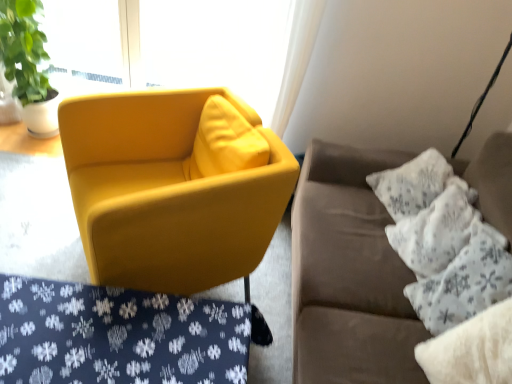
Question: Would you say white fluffy pillow at right, the first pillow when ordered from front to back, is a long distance from white textured pillow at right, which ranks as the first pillow in back-to-front order?

Choices:
 (A) no
 (B) yes

Answer: (A)

Question: Is white fluffy pillow at right, the first pillow when ordered from front to back, surrounding white textured pillow at right, positioned as the third pillow in front-to-back order?

Choices:
 (A) no
 (B) yes

Answer: (A)

Question: Is white fluffy pillow at right, the first pillow when ordered from front to back, aimed at white textured pillow at right, which ranks as the first pillow in back-to-front order?

Choices:
 (A) yes
 (B) no

Answer: (B)

Question: Would you say white fluffy pillow at right, the first pillow when ordered from front to back, is outside white textured pillow at right, which ranks as the first pillow in back-to-front order?

Choices:
 (A) no
 (B) yes

Answer: (B)

Question: From a real-world perspective, is white fluffy pillow at right, which appears as the third pillow when viewed from the back, positioned over white textured pillow at right, positioned as the third pillow in front-to-back order, based on gravity?

Choices:
 (A) no
 (B) yes

Answer: (B)

Question: Is matte glass window at upper left in front of or behind white textured pillow at right, positioned as the third pillow in front-to-back order, in the image?

Choices:
 (A) behind
 (B) front

Answer: (A)

Question: Considering the relative positions of matte glass window at upper left and white textured pillow at right, positioned as the third pillow in front-to-back order, in the image provided, is matte glass window at upper left to the left or to the right of white textured pillow at right, positioned as the third pillow in front-to-back order,?

Choices:
 (A) left
 (B) right

Answer: (A)

Question: Considering the positions of point (226, 66) and point (445, 225), is point (226, 66) closer or farther from the camera than point (445, 225)?

Choices:
 (A) farther
 (B) closer

Answer: (A)

Question: Is matte glass window at upper left spatially inside white textured pillow at right, positioned as the third pillow in front-to-back order, or outside of it?

Choices:
 (A) outside
 (B) inside

Answer: (A)

Question: From the image's perspective, is white textured pillow at right, placed as the 2th pillow when sorted from back to front, located above or below matte yellow armchair at center?

Choices:
 (A) above
 (B) below

Answer: (B)

Question: Is point (485, 271) positioned closer to the camera than point (144, 258)?

Choices:
 (A) closer
 (B) farther

Answer: (A)

Question: Do you think white textured pillow at right, placed as the 2th pillow when sorted from back to front, is within matte yellow armchair at center, or outside of it?

Choices:
 (A) outside
 (B) inside

Answer: (A)

Question: Is white textured pillow at right, the second pillow in the front-to-back sequence, to the left or to the right of matte yellow armchair at center in the image?

Choices:
 (A) right
 (B) left

Answer: (A)

Question: Is point (139, 256) positioned closer to the camera than point (181, 377)?

Choices:
 (A) farther
 (B) closer

Answer: (A)

Question: Would you say matte yellow armchair at center is to the left or to the right of velvet yellow armchair at center in the picture?

Choices:
 (A) right
 (B) left

Answer: (A)